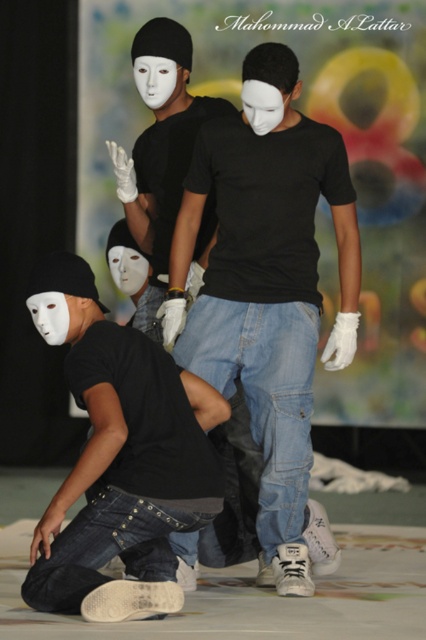
Question: Can you confirm if matte black shirt at center is thinner than matte black shirt at lower left?

Choices:
 (A) no
 (B) yes

Answer: (A)

Question: Among these objects, which one is farthest from the camera?

Choices:
 (A) matte black shirt at center
 (B) matte black shirt at lower left

Answer: (A)

Question: Does matte black shirt at center have a larger size compared to matte black shirt at lower left?

Choices:
 (A) yes
 (B) no

Answer: (A)

Question: Does matte black shirt at center appear on the right side of matte black shirt at lower left?

Choices:
 (A) no
 (B) yes

Answer: (B)

Question: Which point is farther from the camera taking this photo?

Choices:
 (A) (144, 365)
 (B) (216, 353)

Answer: (B)

Question: Which point is farther from the camera taking this photo?

Choices:
 (A) (334, 134)
 (B) (147, 579)

Answer: (A)